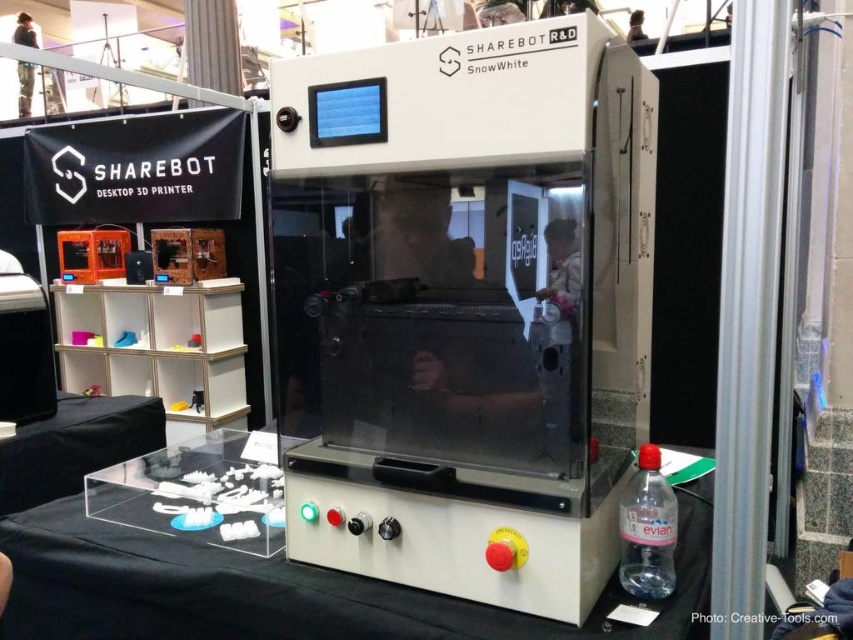
Is point (379, 296) less distant than point (189, 586)?

No, (379, 296) is behind (189, 586).

Which is in front, point (331, 244) or point (354, 577)?

Point (354, 577) is in front.

This screenshot has width=853, height=640. What are the coordinates of `white plastic 3d printer at center` in the screenshot? It's located at (471, 305).